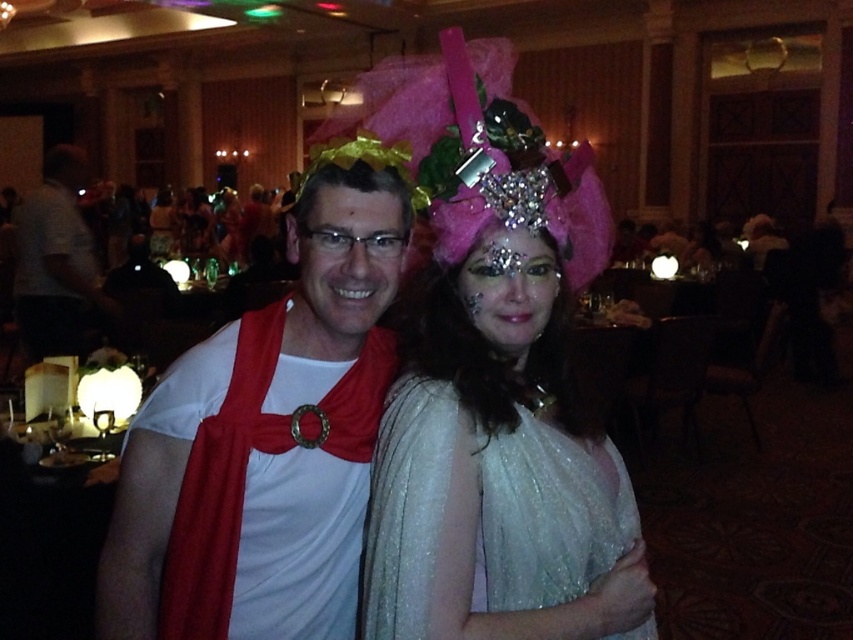
Consider the image. You are a photographer at a party and need to adjust the lighting so that the white sequined dress at center and the pink tulle headdress at center are both well lit. Based on their positions, which one should you focus the light on first to ensure both are properly illuminated?

The white sequined dress at center is below the pink tulle headdress at center, so you should focus the light on the pink tulle headdress at center first. This way, the light will naturally cascade downward and illuminate both the headdress and the dress effectively.

Looking at this image, you are a photographer standing at the front of the banquet hall. You want to take a closeup shot of the white matte toga at center. Can you move closer to the toga to take the photo without exceeding the minimum safe distance of 3 feet required for your camera equipment?

The white matte toga at center is currently 3.38 feet away from the camera. Since the minimum safe distance for your equipment is 3 feet, you can move closer by approximately 0.38 feet to achieve the desired closeup shot without violating the safety requirement.